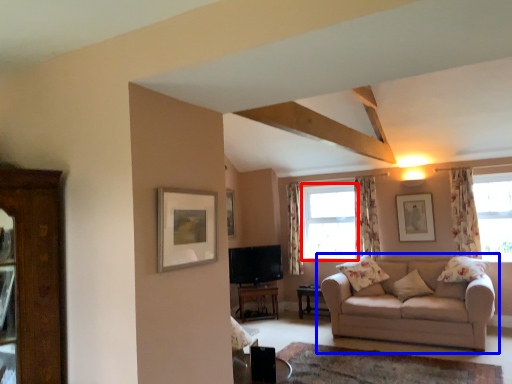
Question: Which of the following is the closest to the observer, window (highlighted by a red box) or studio couch (highlighted by a blue box)?

Choices:
 (A) window
 (B) studio couch

Answer: (B)